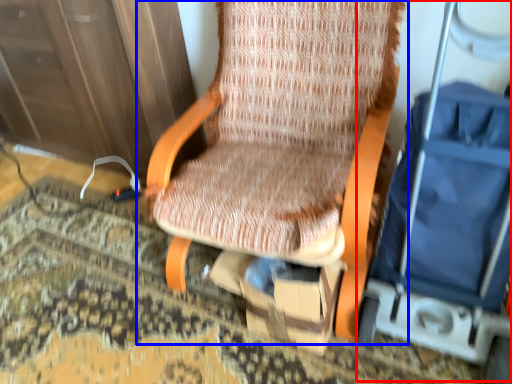
Question: Among these objects, which one is nearest to the camera, baby carriage (highlighted by a red box) or chair (highlighted by a blue box)?

Choices:
 (A) baby carriage
 (B) chair

Answer: (A)